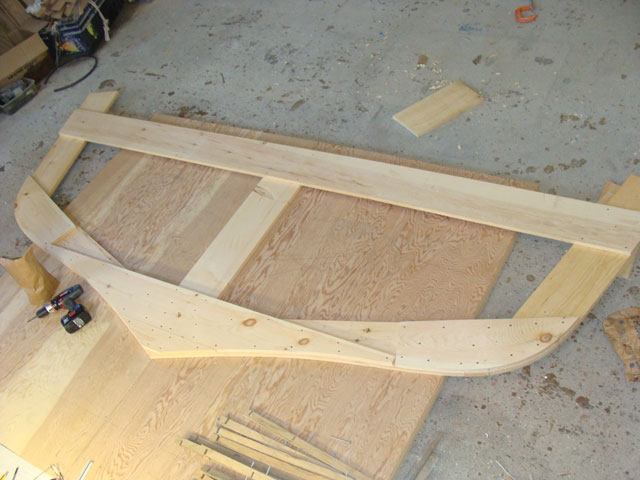
This screenshot has width=640, height=480. Find the location of `left floor`. left floor is located at coordinates (17, 154).